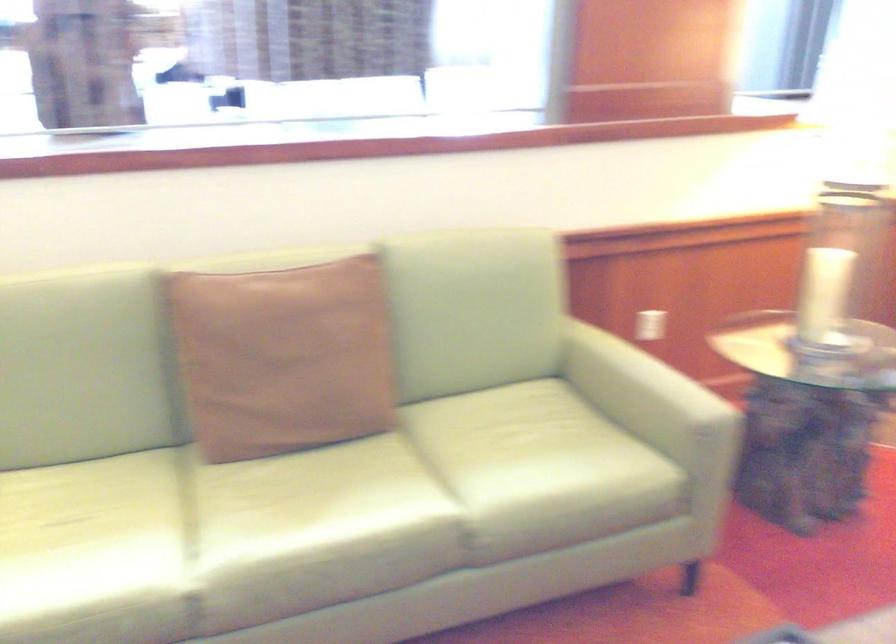
Describe the element at coordinates (650, 325) in the screenshot. Image resolution: width=896 pixels, height=644 pixels. I see `a white light switch` at that location.